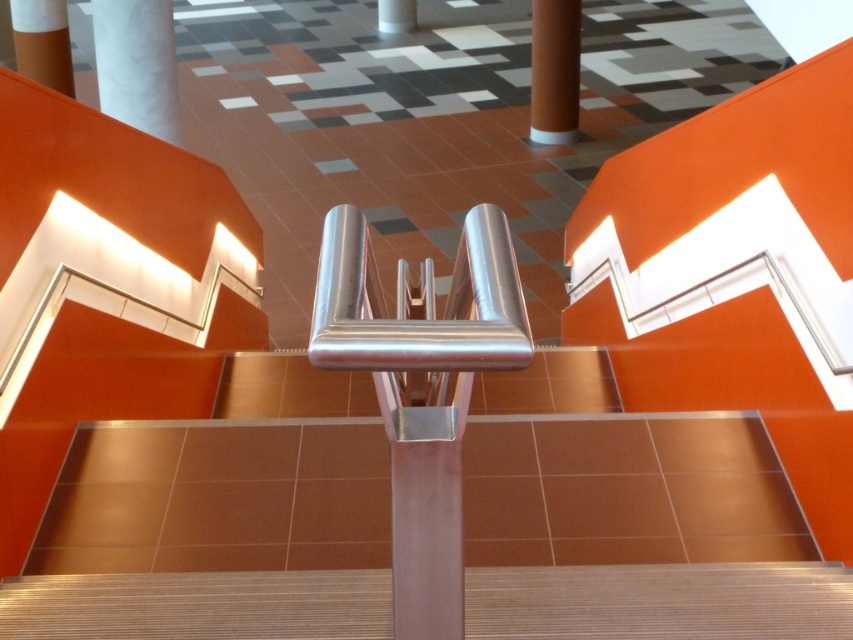
Question: Does white matte pillar at upper left appear under smooth white pillar at center?

Choices:
 (A) no
 (B) yes

Answer: (B)

Question: Which object is the farthest from the satin silver stair at center?

Choices:
 (A) smooth white pillar at center
 (B) white matte pillar at upper left
 (C) orange matte pillar at upper center

Answer: (A)

Question: Which object appears closest to the camera in this image?

Choices:
 (A) orange matte pillar at upper center
 (B) matte orange pillar at upper left
 (C) white matte pillar at upper left

Answer: (C)

Question: Is orange matte pillar at upper center wider than matte orange pillar at upper left?

Choices:
 (A) no
 (B) yes

Answer: (A)

Question: Is satin silver stair at center positioned at the back of white matte pillar at upper left?

Choices:
 (A) yes
 (B) no

Answer: (B)

Question: Which point is closer to the camera?

Choices:
 (A) (93, 6)
 (B) (556, 104)

Answer: (A)